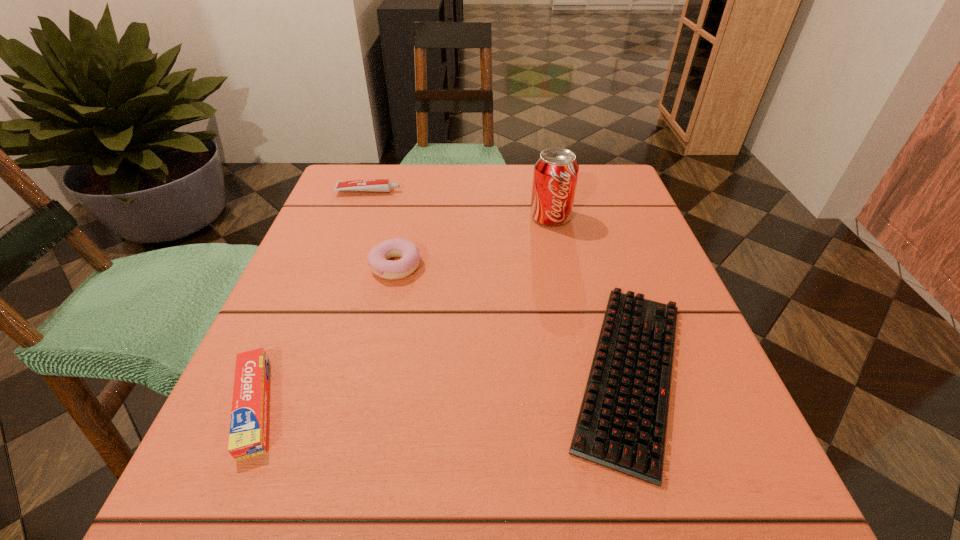
The width and height of the screenshot is (960, 540). Identify the location of free space located on the right of the nearer toothpaste. (370, 406).

At what (x,y) coordinates should I click in order to perform the action: click on vacant space situated 0.210m on the back of the computer keyboard. Please return your answer as a coordinate pair (x, y). Looking at the image, I should click on (586, 225).

In order to click on soda can that is positioned at the far edge in this screenshot , I will do `click(556, 170)`.

Identify the location of toothpaste located in the far edge section of the desktop. (378, 185).

This screenshot has height=540, width=960. Identify the location of toothpaste at the near edge. (248, 427).

Where is `computer keyboard situated at the near edge`? The image size is (960, 540). computer keyboard situated at the near edge is located at coordinates (622, 422).

Where is `doughnut that is at the left edge`? The width and height of the screenshot is (960, 540). doughnut that is at the left edge is located at coordinates (377, 259).

At what (x,y) coordinates should I click in order to perform the action: click on soda can that is at the right edge. Please return your answer as a coordinate pair (x, y). The height and width of the screenshot is (540, 960). Looking at the image, I should click on (556, 170).

The image size is (960, 540). I want to click on computer keyboard at the right edge, so click(x=622, y=422).

The height and width of the screenshot is (540, 960). I want to click on object present at the far left corner, so click(378, 185).